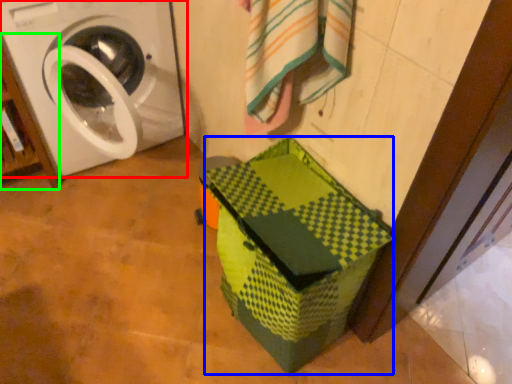
Question: Which is nearer to the washing machine (highlighted by a red box)? cardboard box (highlighted by a blue box) or shelf (highlighted by a green box).

Choices:
 (A) cardboard box
 (B) shelf

Answer: (B)